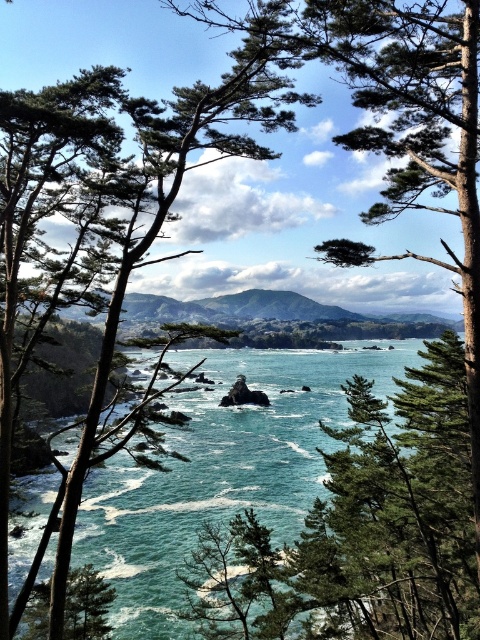
Question: Which object is closer to the camera taking this photo?

Choices:
 (A) teal glossy water at center
 (B) green leafy tree at center

Answer: (B)

Question: Which point is closer to the camera taking this photo?

Choices:
 (A) (182, 401)
 (B) (256, 116)

Answer: (B)

Question: Is teal glossy water at center to the left of green leafy tree at center from the viewer's perspective?

Choices:
 (A) no
 (B) yes

Answer: (A)

Question: Is teal glossy water at center wider than green leafy tree at center?

Choices:
 (A) yes
 (B) no

Answer: (A)

Question: Is teal glossy water at center closer to camera compared to green leafy tree at center?

Choices:
 (A) yes
 (B) no

Answer: (B)